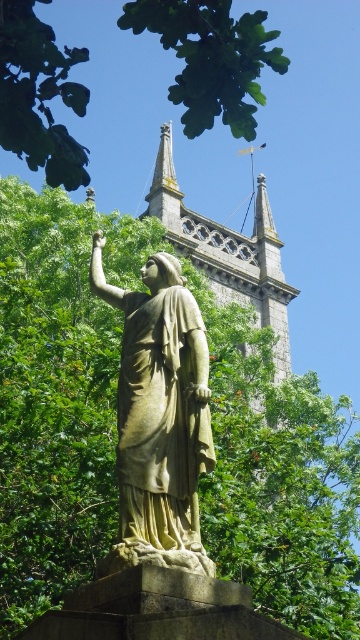
Is point (311, 564) farther from camera compared to point (165, 496)?

Yes, point (311, 564) is behind point (165, 496).

Who is more distant from viewer, (102,525) or (125,433)?

The point (102,525) is more distant.

Where is `green leafy tree at center`? This screenshot has height=640, width=360. green leafy tree at center is located at coordinates (57, 392).

Does green leafy tree at center have a lesser width compared to green leafy tree at upper center?

→ Incorrect, green leafy tree at center's width is not less than green leafy tree at upper center's.

Is green leafy tree at center shorter than green leafy tree at upper center?

Yes.

At what (x,y) coordinates should I click in order to perform the action: click on green leafy tree at center. Please return your answer as a coordinate pair (x, y). The width and height of the screenshot is (360, 640). Looking at the image, I should click on (57, 392).

Is the position of stone statue at center more distant than that of green leafy tree at upper center?

Yes, it is.

You are a GUI agent. You are given a task and a screenshot of the screen. Output one action in this format:
    pyautogui.click(x=<x>, y=<y>)
    Task: Click on the stone statue at center
    The image size is (360, 640).
    Given the screenshot: What is the action you would take?
    pyautogui.click(x=159, y=417)